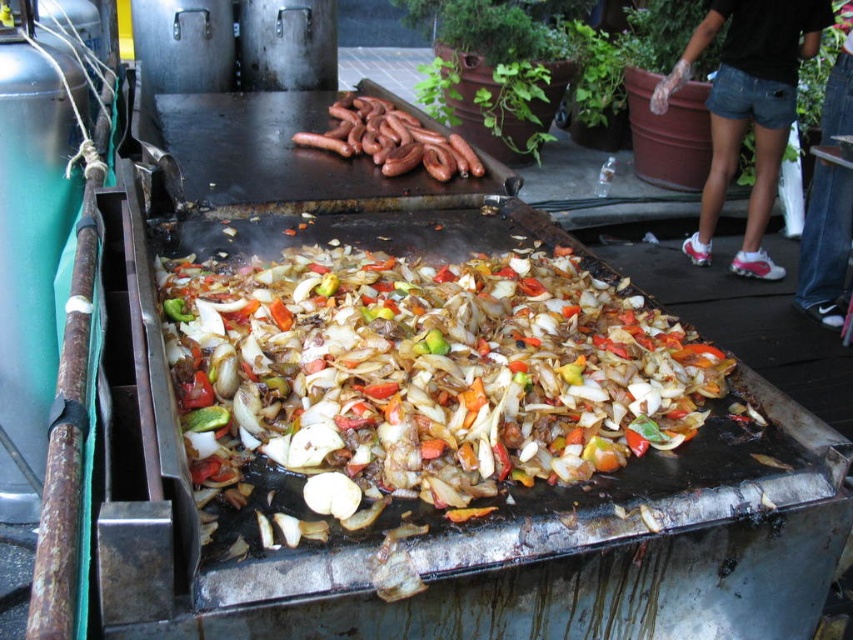
Question: Does slightly browned vegetables at center appear on the left side of brown glossy sausages at center?

Choices:
 (A) no
 (B) yes

Answer: (A)

Question: In this image, where is slightly browned vegetables at center located relative to brown glossy sausages at center?

Choices:
 (A) above
 (B) below

Answer: (B)

Question: Among these objects, which one is nearest to the camera?

Choices:
 (A) brown glossy sausages at center
 (B) slightly browned vegetables at center

Answer: (B)

Question: Which object appears farthest from the camera in this image?

Choices:
 (A) slightly browned vegetables at center
 (B) brown glossy sausages at center

Answer: (B)

Question: Which point is farther to the camera?

Choices:
 (A) (442, 145)
 (B) (641, 337)

Answer: (A)

Question: Does slightly browned vegetables at center appear on the right side of brown glossy sausages at center?

Choices:
 (A) no
 (B) yes

Answer: (B)